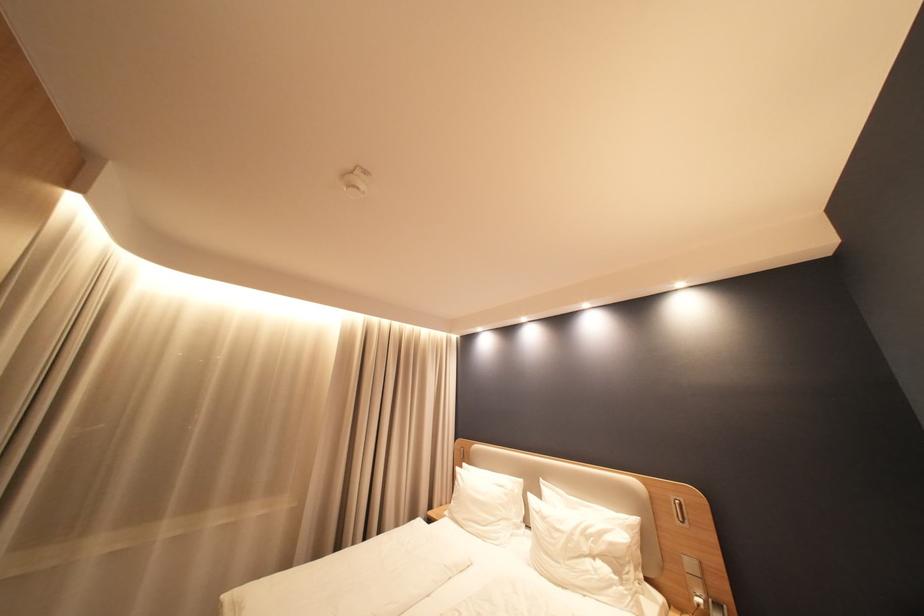
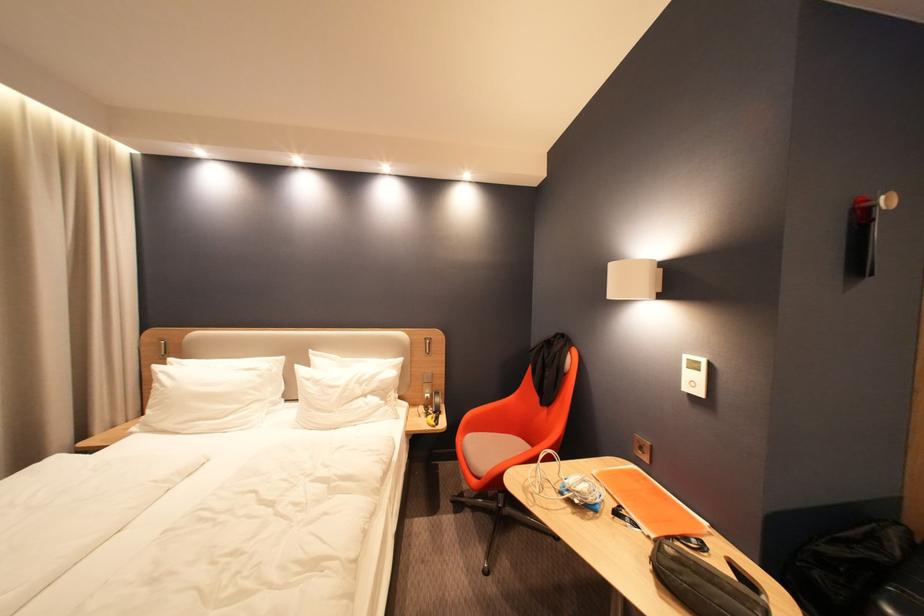
Question: The camera is either moving clockwise (left) or counter-clockwise (right) around the object. The first image is from the beginning of the video and the second image is from the end. Is the camera moving left or right when shooting the video?

Choices:
 (A) Left
 (B) Right

Answer: (A)